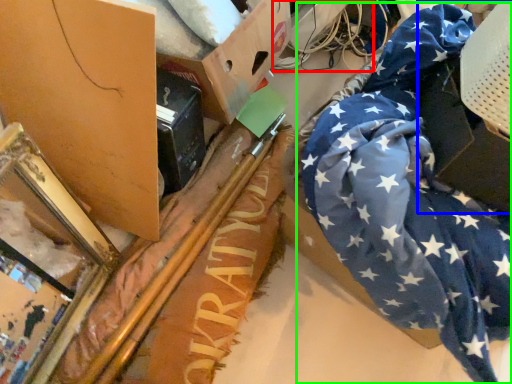
Question: Which is farther away from wire (highlighted by a red box)? cardboard box (highlighted by a blue box) or flag (highlighted by a green box)?

Choices:
 (A) cardboard box
 (B) flag

Answer: (A)